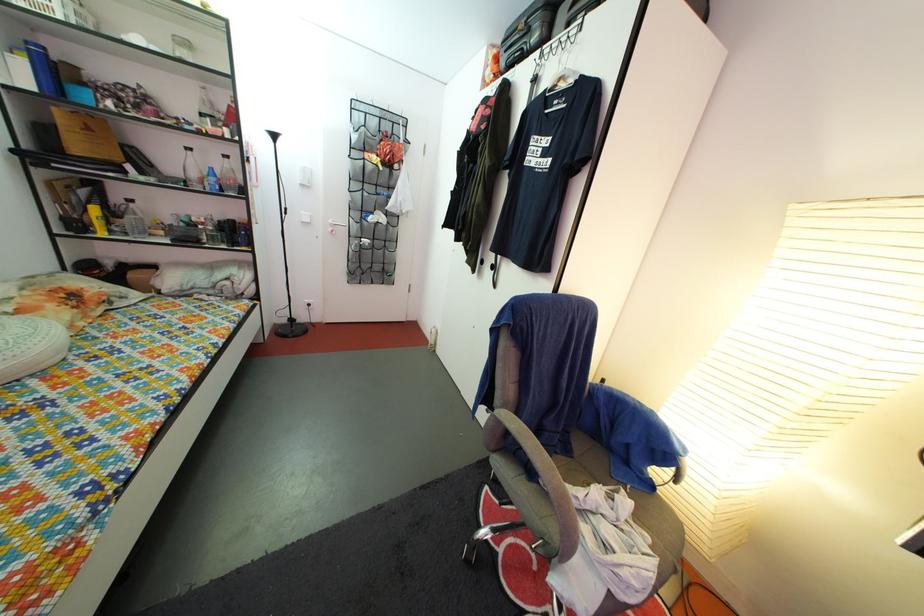
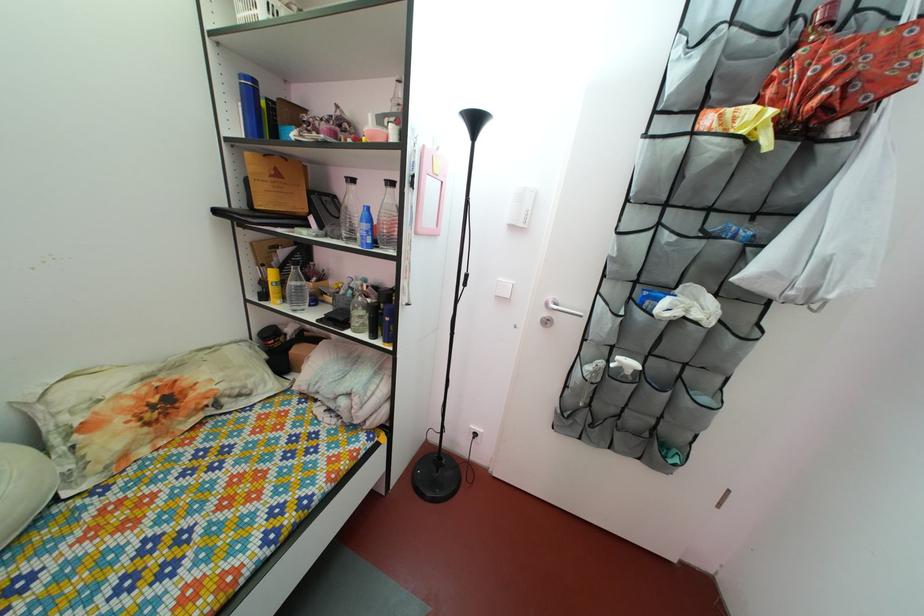
Where in the second image is the point corresponding to point 92,201 from the first image?

(292, 262)